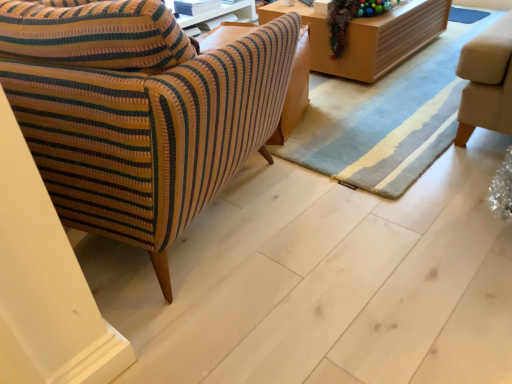
Question: From a real-world perspective, relative to striped fabric armchair at left, is shiny metallic garland at upper right vertically above or below?

Choices:
 (A) above
 (B) below

Answer: (B)

Question: Considering the positions of shiny metallic garland at upper right and striped fabric armchair at left in the image, is shiny metallic garland at upper right wider or thinner than striped fabric armchair at left?

Choices:
 (A) thin
 (B) wide

Answer: (A)

Question: Estimate the real-world distances between objects in this image. Which object is farther from the wooden table at upper center?

Choices:
 (A) striped fabric armchair at left
 (B) shiny metallic garland at upper right

Answer: (A)

Question: Based on their relative distances, which object is nearer to the shiny metallic garland at upper right?

Choices:
 (A) striped fabric armchair at left
 (B) wooden table at upper center

Answer: (B)